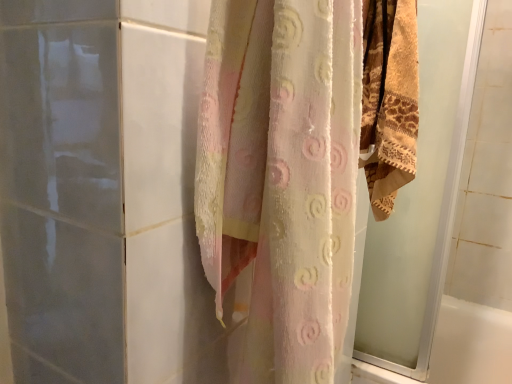
Question: Is the depth of translucent floral curtain at center less than that of beige textured towel at right?

Choices:
 (A) yes
 (B) no

Answer: (A)

Question: From a real-world perspective, does translucent floral curtain at center stand above beige textured towel at right?

Choices:
 (A) yes
 (B) no

Answer: (B)

Question: Considering the relative sizes of translucent floral curtain at center and beige textured towel at right in the image provided, is translucent floral curtain at center shorter than beige textured towel at right?

Choices:
 (A) yes
 (B) no

Answer: (B)

Question: From the image's perspective, is translucent floral curtain at center above beige textured towel at right?

Choices:
 (A) yes
 (B) no

Answer: (B)

Question: Is translucent floral curtain at center wider than beige textured towel at right?

Choices:
 (A) no
 (B) yes

Answer: (B)

Question: Is translucent floral curtain at center smaller than beige textured towel at right?

Choices:
 (A) yes
 (B) no

Answer: (B)

Question: Can you confirm if beige textured towel at right is taller than translucent floral curtain at center?

Choices:
 (A) no
 (B) yes

Answer: (A)

Question: Is beige textured towel at right facing away from translucent floral curtain at center?

Choices:
 (A) yes
 (B) no

Answer: (B)

Question: From a real-world perspective, is beige textured towel at right on top of translucent floral curtain at center?

Choices:
 (A) yes
 (B) no

Answer: (A)

Question: Is beige textured towel at right further to the viewer compared to translucent floral curtain at center?

Choices:
 (A) yes
 (B) no

Answer: (A)

Question: Considering the relative sizes of beige textured towel at right and translucent floral curtain at center in the image provided, is beige textured towel at right bigger than translucent floral curtain at center?

Choices:
 (A) no
 (B) yes

Answer: (A)

Question: Does beige textured towel at right have a lesser width compared to translucent floral curtain at center?

Choices:
 (A) no
 (B) yes

Answer: (B)

Question: Looking at the image, does beige textured towel at right seem bigger or smaller compared to translucent floral curtain at center?

Choices:
 (A) big
 (B) small

Answer: (B)